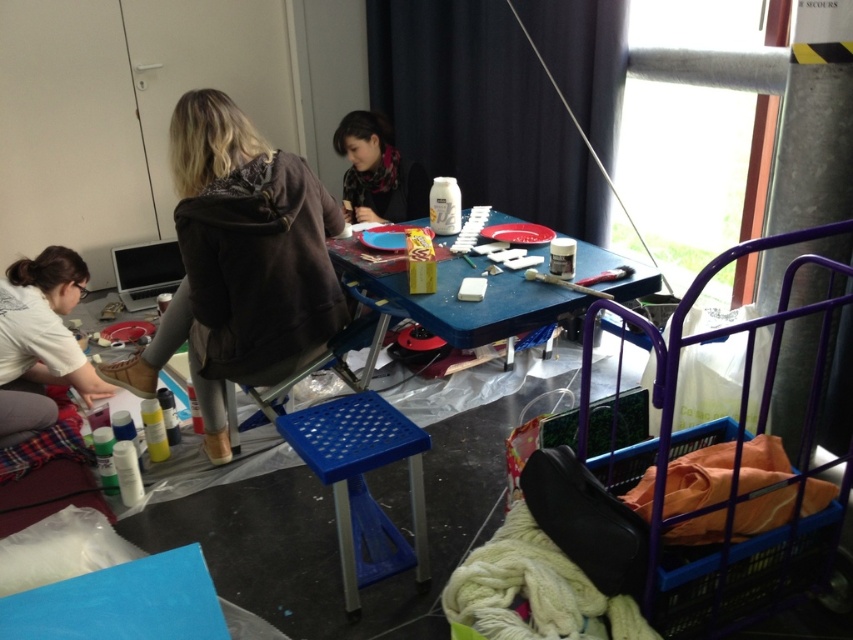
What is the object located at coordinate point (363,481) in the workspace?

The object located at coordinate point (363,481) is the blue plastic stool at center.

You are standing in the workspace and want to reach the white matte shirt at lower left without moving the blue plastic table at center. Is this possible?

The blue plastic table at center is located above the white matte shirt at lower left, so you cannot reach the white matte shirt at lower left without moving the table because it is blocking the path.

You are standing in the workspace and want to reach the blue plastic table at center from the white matte shirt at lower left. Which direction should you move?

You should move to the right to reach the blue plastic table at center from the white matte shirt at lower left since it is positioned to the right of it.